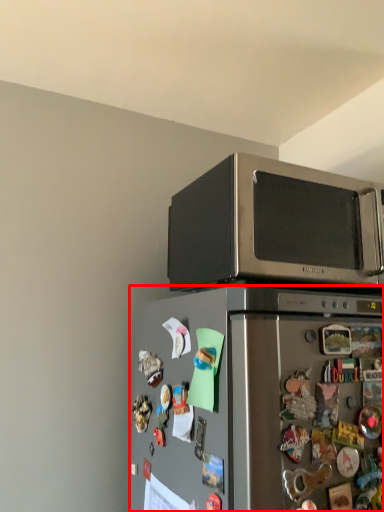
Question: From the image's perspective, considering the relative positions of refrigerator (annotated by the red box) and microwave oven in the image provided, where is refrigerator (annotated by the red box) located with respect to the staircase?

Choices:
 (A) below
 (B) above

Answer: (A)